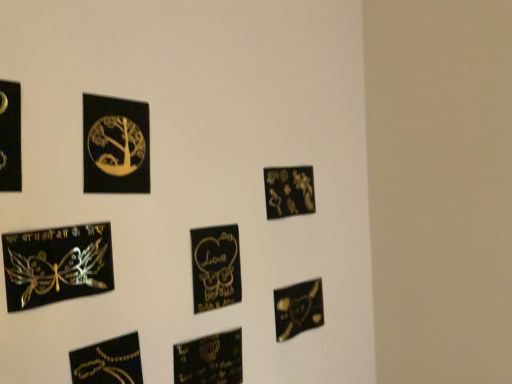
Image resolution: width=512 pixels, height=384 pixels. Find the location of `gold foil tree at upper left, marked as the fourth picture frame in a left-to-right arrangement`. gold foil tree at upper left, marked as the fourth picture frame in a left-to-right arrangement is located at coordinates (115, 145).

This screenshot has height=384, width=512. What do you see at coordinates (298, 309) in the screenshot? I see `matte black heart at lower right, placed as the 1th picture frame when sorted from right to left` at bounding box center [298, 309].

Locate an element on the screen. The height and width of the screenshot is (384, 512). matte black heart at lower right, placed as the 1th picture frame when sorted from right to left is located at coordinates (298, 309).

What do you see at coordinates (209, 359) in the screenshot?
I see `matte black heart at lower center, acting as the fifth picture frame starting from the left` at bounding box center [209, 359].

This screenshot has width=512, height=384. What do you see at coordinates (215, 267) in the screenshot?
I see `black matte sticker at center, the third picture frame from the right` at bounding box center [215, 267].

Locate an element on the screen. The height and width of the screenshot is (384, 512). gold foil tree at upper left, the 5th picture frame when ordered from right to left is located at coordinates (115, 145).

There is a matte black heart at lower right, placed as the 1th picture frame when sorted from right to left. In order to click on the 4th picture frame above it (from the image's perspective) in this screenshot , I will do `click(115, 145)`.

Can you confirm if matte black heart at lower right, marked as the eighth picture frame in a left-to-right arrangement, is wider than gold foil tree at upper left, marked as the fourth picture frame in a left-to-right arrangement?

Indeed, matte black heart at lower right, marked as the eighth picture frame in a left-to-right arrangement, has a greater width compared to gold foil tree at upper left, marked as the fourth picture frame in a left-to-right arrangement.

Does matte black heart at lower right, marked as the eighth picture frame in a left-to-right arrangement, have a larger size compared to gold foil tree at upper left, marked as the fourth picture frame in a left-to-right arrangement?

Indeed, matte black heart at lower right, marked as the eighth picture frame in a left-to-right arrangement, has a larger size compared to gold foil tree at upper left, marked as the fourth picture frame in a left-to-right arrangement.

Considering the positions of point (312, 299) and point (129, 118), is point (312, 299) closer or farther from the camera than point (129, 118)?

Point (312, 299) appears to be farther away from the viewer than point (129, 118).

Find the location of a particular element. picture frame that appears on the left of holographic gold butterfly at lower left, positioned as the seventh picture frame in right-to-left order is located at coordinates (10, 137).

Considering the relative sizes of holographic gold butterfly at lower left, the 2th picture frame positioned from the left, and black glossy picture frame at left, which is the eighth picture frame in right-to-left order, in the image provided, is holographic gold butterfly at lower left, the 2th picture frame positioned from the left, taller than black glossy picture frame at left, which is the eighth picture frame in right-to-left order,?

Incorrect, the height of holographic gold butterfly at lower left, the 2th picture frame positioned from the left, is not larger of that of black glossy picture frame at left, which is the eighth picture frame in right-to-left order.

Are holographic gold butterfly at lower left, positioned as the seventh picture frame in right-to-left order, and black glossy picture frame at left, which is the eighth picture frame in right-to-left order, far apart?

Actually, holographic gold butterfly at lower left, positioned as the seventh picture frame in right-to-left order, and black glossy picture frame at left, which is the eighth picture frame in right-to-left order, are a little close together.

Between black matte sticker at center, the third picture frame from the right, and holographic gold butterfly at lower left, the 2th picture frame positioned from the left, which one is positioned behind?

black matte sticker at center, the third picture frame from the right, is further away from the camera.

Looking at this image, could you tell me if black matte sticker at center, the third picture frame from the right, is facing holographic gold butterfly at lower left, the 2th picture frame positioned from the left?

No, black matte sticker at center, the third picture frame from the right, is not oriented towards holographic gold butterfly at lower left, the 2th picture frame positioned from the left.

How far apart are black matte sticker at center, the sixth picture frame from the left, and holographic gold butterfly at lower left, positioned as the seventh picture frame in right-to-left order?

black matte sticker at center, the sixth picture frame from the left, and holographic gold butterfly at lower left, positioned as the seventh picture frame in right-to-left order, are 11.64 inches apart from each other.

Is black matte sticker at center, the third picture frame from the right, not within holographic gold butterfly at lower left, positioned as the seventh picture frame in right-to-left order?

Absolutely, black matte sticker at center, the third picture frame from the right, is external to holographic gold butterfly at lower left, positioned as the seventh picture frame in right-to-left order.

Who is shorter, matte black heart at lower right, placed as the 1th picture frame when sorted from right to left, or black matte sticker at center, the sixth picture frame from the left?

With less height is matte black heart at lower right, placed as the 1th picture frame when sorted from right to left.

Considering the relative positions of matte black heart at lower right, marked as the eighth picture frame in a left-to-right arrangement, and black matte sticker at center, the third picture frame from the right, in the image provided, is matte black heart at lower right, marked as the eighth picture frame in a left-to-right arrangement, to the left or to the right of black matte sticker at center, the third picture frame from the right,?

matte black heart at lower right, marked as the eighth picture frame in a left-to-right arrangement, is positioned on black matte sticker at center, the third picture frame from the right,'s right side.

From a real-world perspective, relative to black matte sticker at center, the third picture frame from the right, is matte black heart at lower right, marked as the eighth picture frame in a left-to-right arrangement, vertically above or below?

In terms of real-world spatial position, matte black heart at lower right, marked as the eighth picture frame in a left-to-right arrangement, is below black matte sticker at center, the third picture frame from the right.

Is matte black heart at lower right, placed as the 1th picture frame when sorted from right to left, next to black matte sticker at center, the third picture frame from the right, and touching it?

They are not placed beside each other.

Is matte black heart at lower center, acting as the fifth picture frame starting from the left, spatially inside black glossy picture frame at left, which is the eighth picture frame in right-to-left order, or outside of it?

matte black heart at lower center, acting as the fifth picture frame starting from the left, exists outside the volume of black glossy picture frame at left, which is the eighth picture frame in right-to-left order.

How far apart are matte black heart at lower center, placed as the 4th picture frame when sorted from right to left, and black glossy picture frame at left, which is the eighth picture frame in right-to-left order?

matte black heart at lower center, placed as the 4th picture frame when sorted from right to left, is 23.27 inches from black glossy picture frame at left, which is the eighth picture frame in right-to-left order.

Can you confirm if matte black heart at lower center, placed as the 4th picture frame when sorted from right to left, is wider than black glossy picture frame at left, which is the eighth picture frame in right-to-left order?

Yes.

Does matte black heart at lower center, acting as the fifth picture frame starting from the left, turn towards black glossy picture frame at left, the 1th picture frame viewed from the left?

No, matte black heart at lower center, acting as the fifth picture frame starting from the left, is not oriented towards black glossy picture frame at left, the 1th picture frame viewed from the left.

Which is closer, (x=1, y=189) or (x=290, y=183)?

The point (x=1, y=189) is more forward.

Considering the positions of objects black glossy picture frame at left, which is the eighth picture frame in right-to-left order, and matte gold plaque at upper right, which ranks as the 2th picture frame in right-to-left order, in the image provided, who is behind, black glossy picture frame at left, which is the eighth picture frame in right-to-left order, or matte gold plaque at upper right, which ranks as the 2th picture frame in right-to-left order,?

matte gold plaque at upper right, which ranks as the 2th picture frame in right-to-left order, is further away from the camera.

Would you say black glossy picture frame at left, which is the eighth picture frame in right-to-left order, is to the left or to the right of matte gold plaque at upper right, the seventh picture frame when ordered from left to right, in the picture?

In the image, black glossy picture frame at left, which is the eighth picture frame in right-to-left order, appears on the left side of matte gold plaque at upper right, the seventh picture frame when ordered from left to right.

This screenshot has height=384, width=512. Find the location of `the 2nd picture frame above the matte gold plaque at upper right, which ranks as the 2th picture frame in right-to-left order (from the image's perspective)`. the 2nd picture frame above the matte gold plaque at upper right, which ranks as the 2th picture frame in right-to-left order (from the image's perspective) is located at coordinates (10, 137).

Is metallic gold chain at lower left, which is counted as the 6th picture frame, starting from the right, in front of or behind matte gold plaque at upper right, which ranks as the 2th picture frame in right-to-left order, in the image?

In the image, metallic gold chain at lower left, which is counted as the 6th picture frame, starting from the right, appears in front of matte gold plaque at upper right, which ranks as the 2th picture frame in right-to-left order.

Between metallic gold chain at lower left, which is counted as the 6th picture frame, starting from the right, and matte gold plaque at upper right, which ranks as the 2th picture frame in right-to-left order, which one has more height?

metallic gold chain at lower left, which is counted as the 6th picture frame, starting from the right.

Can you confirm if metallic gold chain at lower left, which is counted as the 6th picture frame, starting from the right, is thinner than matte gold plaque at upper right, which ranks as the 2th picture frame in right-to-left order?

Indeed, metallic gold chain at lower left, which is counted as the 6th picture frame, starting from the right, has a lesser width compared to matte gold plaque at upper right, which ranks as the 2th picture frame in right-to-left order.

The image size is (512, 384). Identify the location of picture frame that is the 4th object to the left of the matte gold plaque at upper right, which ranks as the 2th picture frame in right-to-left order, starting at the anchor. (108, 362).

This screenshot has height=384, width=512. I want to click on picture frame that is the 4th object above the matte black heart at lower right, marked as the eighth picture frame in a left-to-right arrangement (from a real-world perspective), so click(115, 145).

The width and height of the screenshot is (512, 384). Identify the location of the 3rd picture frame below the black glossy picture frame at left, the 1th picture frame viewed from the left (from the image's perspective). click(57, 265).

Based on the photo, which object lies further to the anchor point matte black heart at lower right, placed as the 1th picture frame when sorted from right to left, black matte sticker at center, the sixth picture frame from the left, or matte gold plaque at upper right, the seventh picture frame when ordered from left to right?

Among the two, matte gold plaque at upper right, the seventh picture frame when ordered from left to right, is located further to matte black heart at lower right, placed as the 1th picture frame when sorted from right to left.

Looking at the image, which one is located closer to gold foil tree at upper left, marked as the fourth picture frame in a left-to-right arrangement, black glossy picture frame at left, which is the eighth picture frame in right-to-left order, or metallic gold chain at lower left, which is counted as the 6th picture frame, starting from the right?

black glossy picture frame at left, which is the eighth picture frame in right-to-left order, is closer to gold foil tree at upper left, marked as the fourth picture frame in a left-to-right arrangement.

Estimate the real-world distances between objects in this image. Which object is further from black matte sticker at center, the sixth picture frame from the left, holographic gold butterfly at lower left, the 2th picture frame positioned from the left, or gold foil tree at upper left, marked as the fourth picture frame in a left-to-right arrangement?

holographic gold butterfly at lower left, the 2th picture frame positioned from the left, lies further to black matte sticker at center, the sixth picture frame from the left, than the other object.

Based on their spatial positions, is black matte sticker at center, the sixth picture frame from the left, or black glossy picture frame at left, the 1th picture frame viewed from the left, closer to matte black heart at lower right, placed as the 1th picture frame when sorted from right to left?

Based on the image, black matte sticker at center, the sixth picture frame from the left, appears to be nearer to matte black heart at lower right, placed as the 1th picture frame when sorted from right to left.

Estimate the real-world distances between objects in this image. Which object is closer to matte black heart at lower center, acting as the fifth picture frame starting from the left, matte black heart at lower right, marked as the eighth picture frame in a left-to-right arrangement, or holographic gold butterfly at lower left, the 2th picture frame positioned from the left?

The object closer to matte black heart at lower center, acting as the fifth picture frame starting from the left, is matte black heart at lower right, marked as the eighth picture frame in a left-to-right arrangement.

Which object lies further to the anchor point gold foil tree at upper left, the 5th picture frame when ordered from right to left, black matte sticker at center, the third picture frame from the right, or metallic gold chain at lower left, which is counted as the 6th picture frame, starting from the right?

metallic gold chain at lower left, which is counted as the 6th picture frame, starting from the right.

Estimate the real-world distances between objects in this image. Which object is closer to black matte sticker at center, the third picture frame from the right, metallic gold chain at lower left, placed as the 3th picture frame when sorted from left to right, or matte gold plaque at upper right, which ranks as the 2th picture frame in right-to-left order?

matte gold plaque at upper right, which ranks as the 2th picture frame in right-to-left order.

Estimate the real-world distances between objects in this image. Which object is further from black glossy picture frame at left, the 1th picture frame viewed from the left, black matte sticker at center, the third picture frame from the right, or matte black heart at lower right, placed as the 1th picture frame when sorted from right to left?

matte black heart at lower right, placed as the 1th picture frame when sorted from right to left, lies further to black glossy picture frame at left, the 1th picture frame viewed from the left, than the other object.